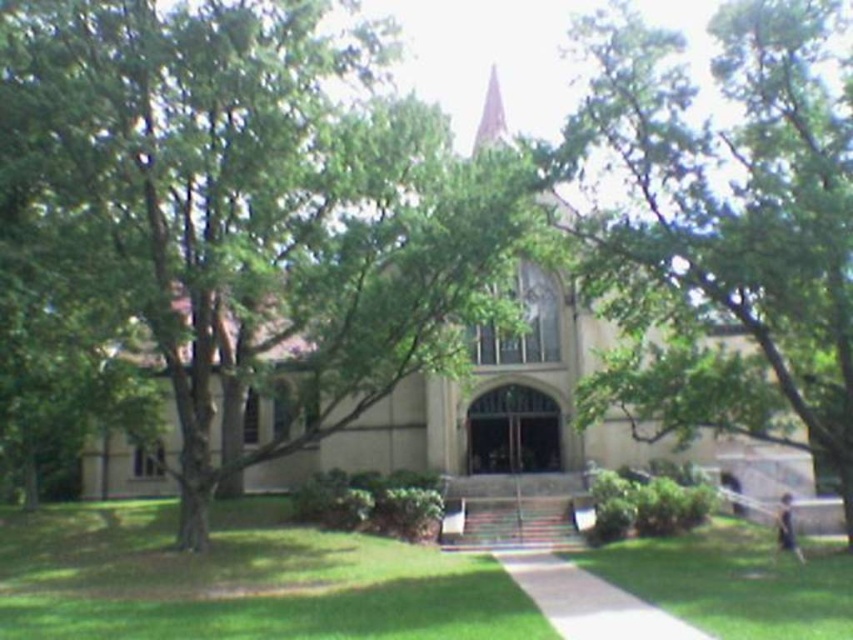
You are standing on the lawn and want to take a photo of the light brown stone spire at upper center. Since the green grass at center is in front of it, will the grass block your view of the spire?

The green grass at center has a lesser height compared to light brown stone spire at upper center, so the grass will not block your view of the spire.